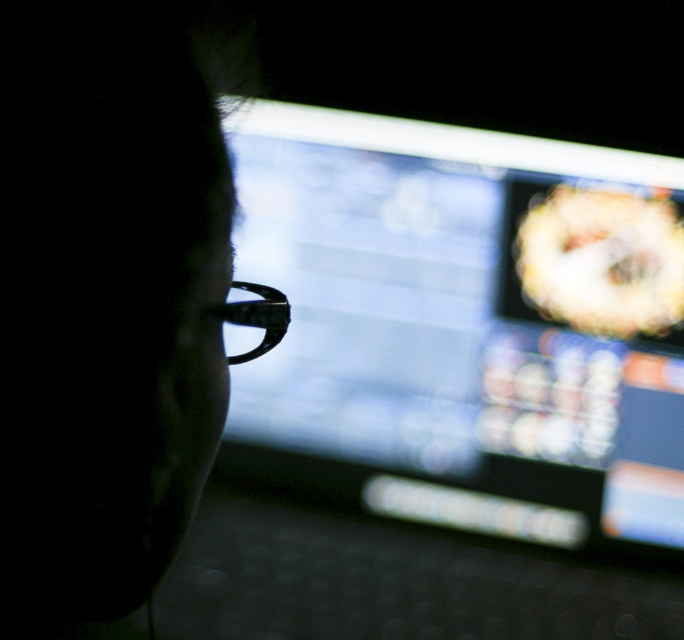
You are trying to determine if the matte black monitor at center can fit through a doorway that is the same width as the black matte glasses at left. Can it fit?

The matte black monitor at center is wider than the black matte glasses at left, so it cannot fit through the doorway which is the same width as the black matte glasses at left.

You are trying to adjust your glasses to see the computer screen better. Based on the scene, where is the matte black monitor at center relative to the black plastic glasses at center?

The matte black monitor at center is positioned under the black plastic glasses at center, so the monitor is below the glasses.